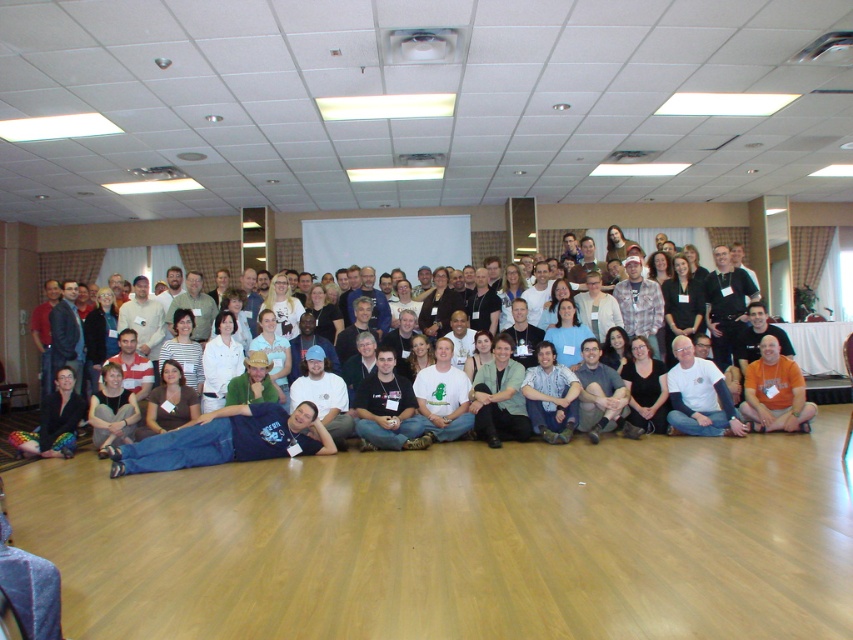
Is blue denim jeans at lower center closer to the viewer compared to white t-shirt at center?

Yes, blue denim jeans at lower center is in front of white t-shirt at center.

In the scene shown: Is blue denim jeans at lower center smaller than white t-shirt at center?

Incorrect, blue denim jeans at lower center is not smaller in size than white t-shirt at center.

Who is more distant from viewer, (300, 412) or (10, 454)?

Positioned behind is point (10, 454).

The image size is (853, 640). I want to click on blue denim jeans at lower center, so 227,440.